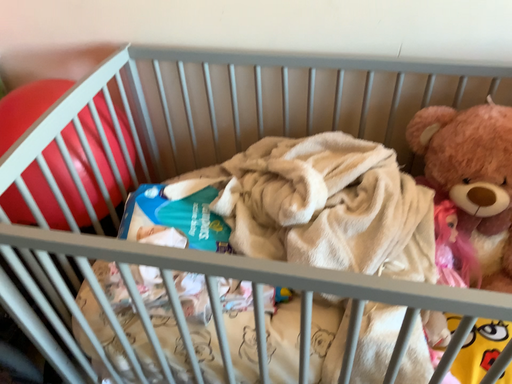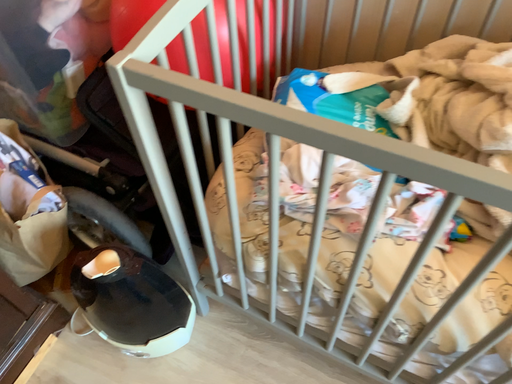
Question: How did the camera likely rotate when shooting the video?

Choices:
 (A) rotated right
 (B) rotated left

Answer: (B)